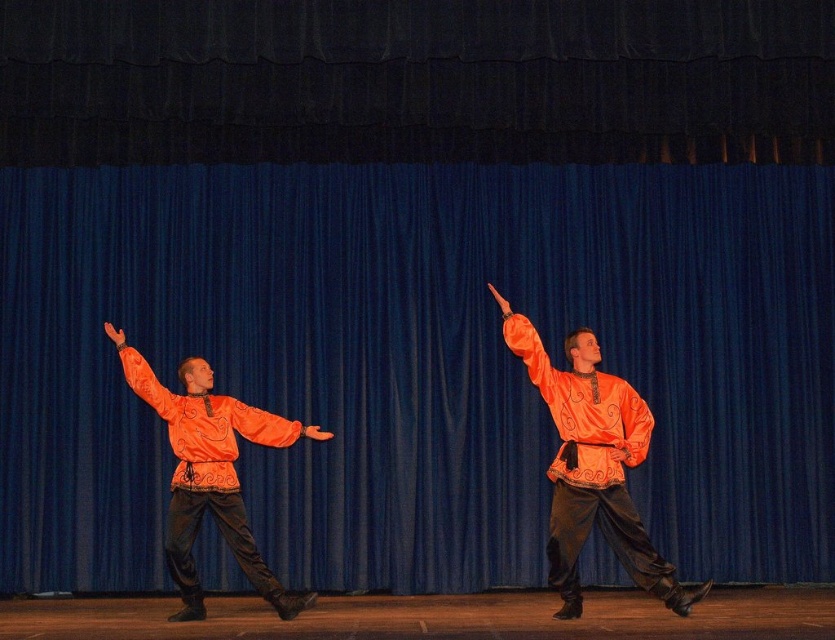
Question: Is orange satin hand at upper center closer to the viewer compared to orange fabric hand at center?

Choices:
 (A) yes
 (B) no

Answer: (B)

Question: Which point is closer to the camera?

Choices:
 (A) (509, 310)
 (B) (120, 344)
 (C) (195, 579)
 (D) (600, 394)

Answer: (A)

Question: Does orange satin shirt at center come behind satin orange robe at left?

Choices:
 (A) no
 (B) yes

Answer: (A)

Question: Is satin orange robe at left further to camera compared to orange satin hand at center?

Choices:
 (A) yes
 (B) no

Answer: (B)

Question: Which of the following is the farthest from the observer?

Choices:
 (A) (120, 332)
 (B) (196, 408)
 (C) (307, 426)

Answer: (C)

Question: Which object is closer to the camera taking this photo?

Choices:
 (A) satin orange robe at left
 (B) orange satin hand at upper center

Answer: (A)